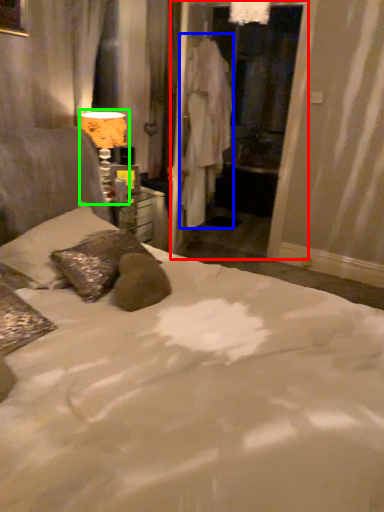
Question: Estimate the real-world distances between objects in this image. Which object is farther from screen door (highlighted by a red box), robe (highlighted by a blue box) or table lamp (highlighted by a green box)?

Choices:
 (A) robe
 (B) table lamp

Answer: (B)